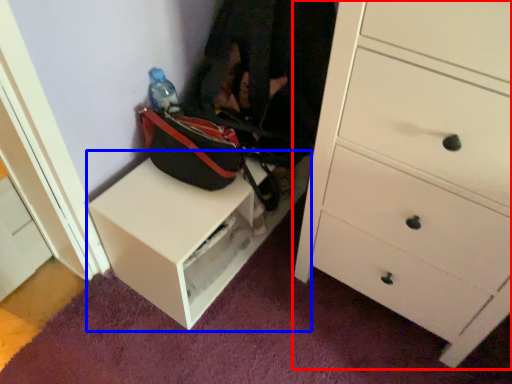
Question: Among these objects, which one is farthest to the camera, chest of drawers (highlighted by a red box) or table (highlighted by a blue box)?

Choices:
 (A) chest of drawers
 (B) table

Answer: (B)